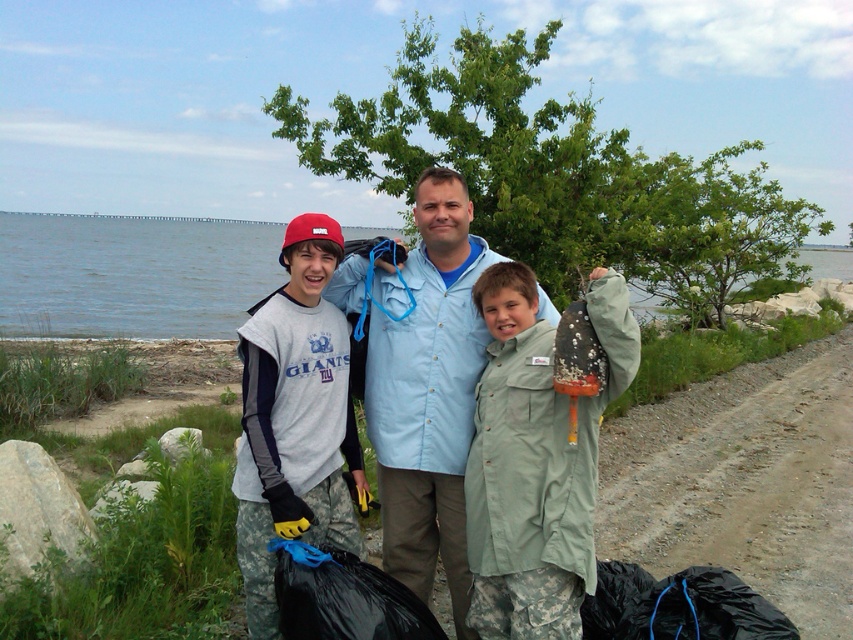
You are a photographer trying to capture the two boys in the scene. You notice the gray camouflage pants at center and the light blue shirt at center. Based on their positions, which clothing item is closer to the ground?

The gray camouflage pants at center is below the light blue shirt at center, so the gray camouflage pants at center is closer to the ground.

You are a photographer trying to capture a photo of the blue water at center and the light blue shirt at center. Based on their heights, which one should you focus on first to ensure both are in the frame?

The blue water at center has a greater height compared to the light blue shirt at center, so you should focus on the blue water at center first to ensure both are in the frame.